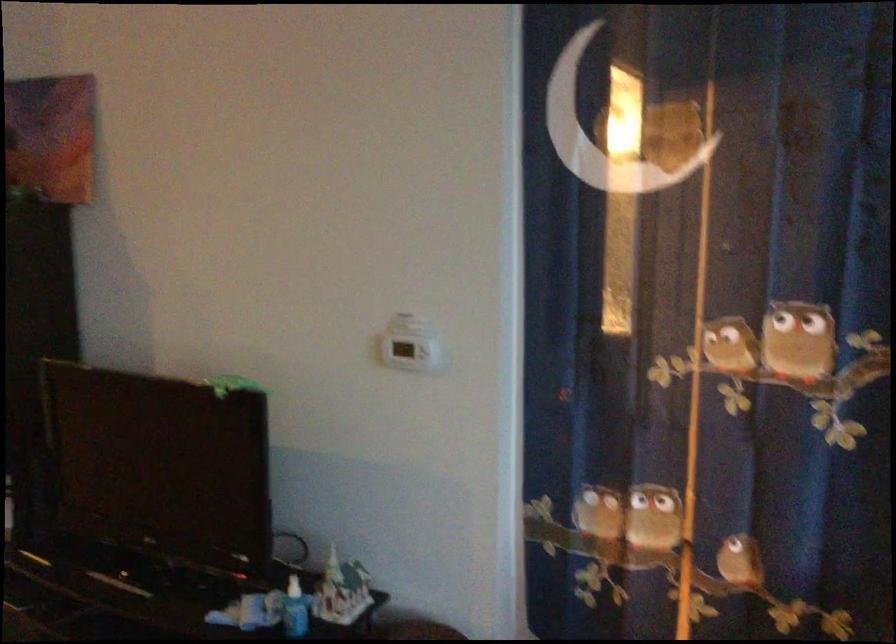
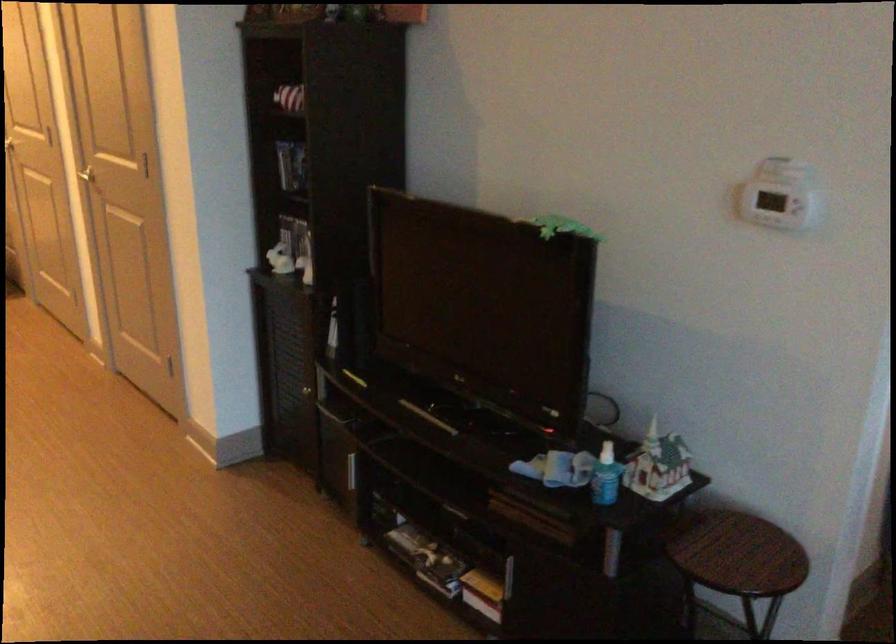
What movement of the cameraman would produce the second image?

The cameraman moved toward left, forward.